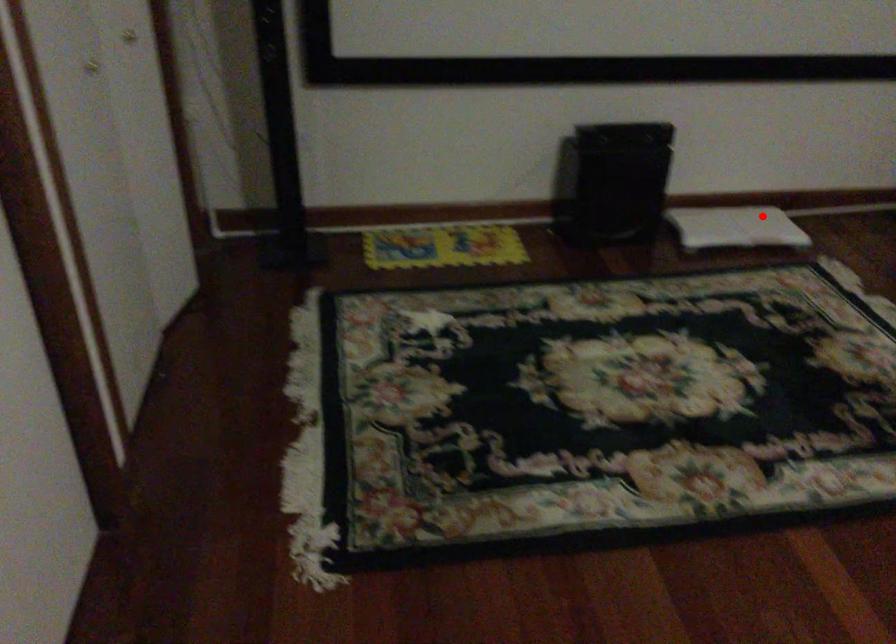
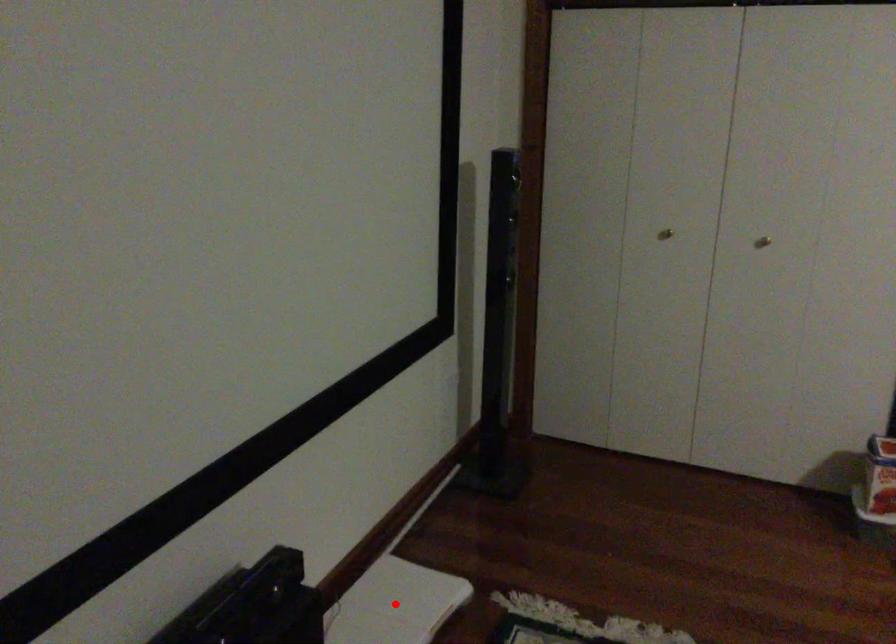
I am providing you with two images of the same scene from different viewpoints. A red point is marked on the first image and another point is marked on the second image. Do the highlighted points in image1 and image2 indicate the same real-world spot?

Yes